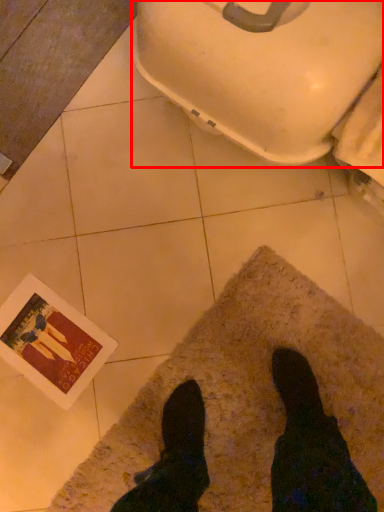
Question: From the image's perspective, where is toilet bowl (annotated by the red box) located relative to mat?

Choices:
 (A) above
 (B) below

Answer: (A)